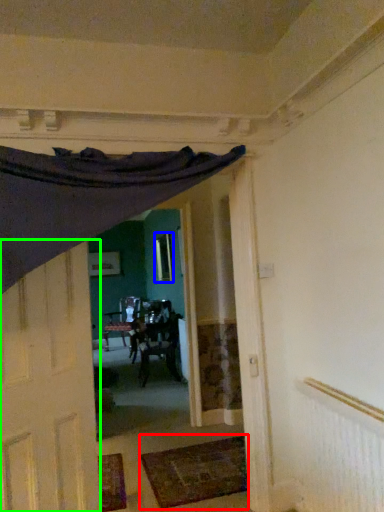
Question: Which is farther away from mat (highlighted by a red box)? window (highlighted by a blue box) or door (highlighted by a green box)?

Choices:
 (A) window
 (B) door

Answer: (A)